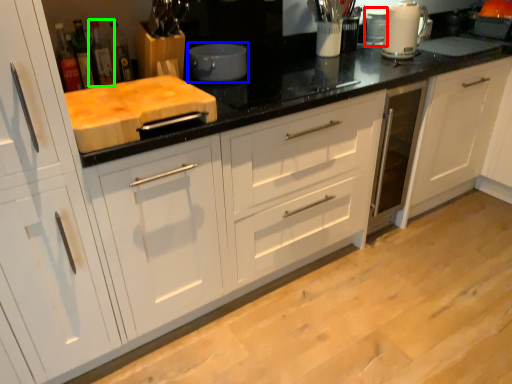
Question: Estimate the real-world distances between objects in this image. Which object is farther from appliance (highlighted by a red box), kitchen appliance (highlighted by a blue box) or bottle (highlighted by a green box)?

Choices:
 (A) kitchen appliance
 (B) bottle

Answer: (B)